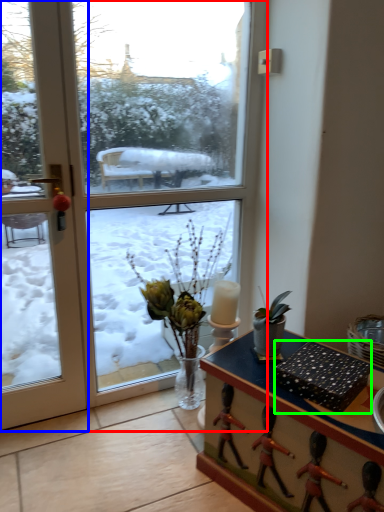
Question: Estimate the real-world distances between objects in this image. Which object is farther from window (highlighted by a red box), door (highlighted by a blue box) or box (highlighted by a green box)?

Choices:
 (A) door
 (B) box

Answer: (B)